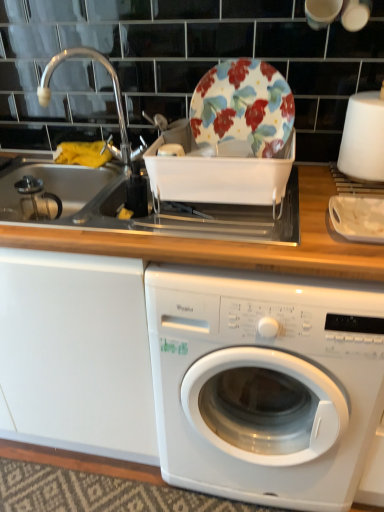
Describe the element at coordinates (265, 385) in the screenshot. This screenshot has height=512, width=384. I see `white glossy washing machine at center` at that location.

The height and width of the screenshot is (512, 384). What do you see at coordinates (358, 218) in the screenshot? I see `white plastic container at right` at bounding box center [358, 218].

This screenshot has height=512, width=384. Find the location of `floral-patterned ceramic plate at upper center`. floral-patterned ceramic plate at upper center is located at coordinates (244, 108).

From a real-world perspective, is floral-patterned ceramic plate at upper center physically above white plastic container at right?

Yes, from a real-world perspective, floral-patterned ceramic plate at upper center is on top of white plastic container at right.

Considering the relative positions of floral-patterned ceramic plate at upper center and white plastic container at right in the image provided, is floral-patterned ceramic plate at upper center to the left or to the right of white plastic container at right?

Based on their positions, floral-patterned ceramic plate at upper center is located to the left of white plastic container at right.

Identify the location of tableware located on the right of floral-patterned ceramic plate at upper center. This screenshot has height=512, width=384. (358, 218).

Based on the photo, considering the sizes of objects white glossy washing machine at center and white plastic container at right in the image provided, who is shorter, white glossy washing machine at center or white plastic container at right?

With less height is white plastic container at right.

Between white glossy washing machine at center and white plastic container at right, which one has smaller width?

With smaller width is white plastic container at right.

Is white glossy washing machine at center inside the boundaries of white plastic container at right, or outside?

white glossy washing machine at center exists outside the volume of white plastic container at right.

Is white glossy washing machine at center in contact with brushed metal sink at left?

No, white glossy washing machine at center is not beside brushed metal sink at left.

Which object is closer to the camera taking this photo, white glossy washing machine at center or brushed metal sink at left?

white glossy washing machine at center is more forward.

Which of these two, white glossy washing machine at center or brushed metal sink at left, stands shorter?

Standing shorter between the two is brushed metal sink at left.

Locate an element on the screen. This screenshot has height=512, width=384. sink behind the white glossy washing machine at center is located at coordinates (115, 100).

From the picture: Is floral-patterned ceramic plate at upper center oriented towards brushed metal sink at left?

No.

Considering the sizes of floral-patterned ceramic plate at upper center and brushed metal sink at left in the image, is floral-patterned ceramic plate at upper center taller or shorter than brushed metal sink at left?

floral-patterned ceramic plate at upper center is shorter than brushed metal sink at left.

Is floral-patterned ceramic plate at upper center wider than brushed metal sink at left?

No, floral-patterned ceramic plate at upper center is not wider than brushed metal sink at left.

Is floral-patterned ceramic plate at upper center positioned far away from brushed metal sink at left?

They are positioned close to each other.

From a real-world perspective, is white plastic container at right located higher than white glossy washing machine at center?

Correct, in the physical world, white plastic container at right is higher than white glossy washing machine at center.

Is white plastic container at right located outside white glossy washing machine at center?

Yes.

Can you confirm if white plastic container at right is smaller than white glossy washing machine at center?

Correct, white plastic container at right occupies less space than white glossy washing machine at center.

Considering the sizes of objects white plastic container at right and white glossy washing machine at center in the image provided, who is shorter, white plastic container at right or white glossy washing machine at center?

white plastic container at right.

Is white plastic container at right taller than brushed metal sink at left?

In fact, white plastic container at right may be shorter than brushed metal sink at left.

Is white plastic container at right situated inside brushed metal sink at left or outside?

white plastic container at right is not inside brushed metal sink at left, it's outside.

From a real-world perspective, which is physically above, white plastic container at right or brushed metal sink at left?

In real-world perspective, brushed metal sink at left is above.

Is white plastic container at right positioned behind brushed metal sink at left?

No, it is in front of brushed metal sink at left.

Are white plastic container at right and floral-patterned ceramic plate at upper center far apart?

No, white plastic container at right is in close proximity to floral-patterned ceramic plate at upper center.

Which object is thinner, white plastic container at right or floral-patterned ceramic plate at upper center?

Thinner between the two is floral-patterned ceramic plate at upper center.

From the image's perspective, would you say white plastic container at right is shown under floral-patterned ceramic plate at upper center?

Yes, from the image's perspective, white plastic container at right is beneath floral-patterned ceramic plate at upper center.

Where is `tableware below the floral-patterned ceramic plate at upper center (from the image's perspective)`? The image size is (384, 512). tableware below the floral-patterned ceramic plate at upper center (from the image's perspective) is located at coordinates (358, 218).

Find the location of a particular element. The width and height of the screenshot is (384, 512). tableware that is above the white glossy washing machine at center (from the image's perspective) is located at coordinates (358, 218).

From the image, which object appears to be nearer to brushed metal sink at left, white plastic container at right or floral-patterned ceramic plate at upper center?

floral-patterned ceramic plate at upper center lies closer to brushed metal sink at left than the other object.

Which object lies nearer to the anchor point white glossy washing machine at center, floral-patterned ceramic plate at upper center or white plastic container at right?

white plastic container at right is closer to white glossy washing machine at center.

Looking at the image, which one is located further to white plastic container at right, floral-patterned ceramic plate at upper center or brushed metal sink at left?

brushed metal sink at left is positioned further to the anchor white plastic container at right.

When comparing their distances from floral-patterned ceramic plate at upper center, does brushed metal sink at left or white plastic container at right seem closer?

Based on the image, white plastic container at right appears to be nearer to floral-patterned ceramic plate at upper center.

Considering their positions, is white plastic container at right positioned closer to white glossy washing machine at center than floral-patterned ceramic plate at upper center?

white plastic container at right lies closer to white glossy washing machine at center than the other object.

From the image, which object appears to be farther from white glossy washing machine at center, floral-patterned ceramic plate at upper center or brushed metal sink at left?

Based on the image, brushed metal sink at left appears to be further to white glossy washing machine at center.

When comparing their distances from floral-patterned ceramic plate at upper center, does white glossy washing machine at center or brushed metal sink at left seem closer?

brushed metal sink at left is positioned closer to the anchor floral-patterned ceramic plate at upper center.

Estimate the real-world distances between objects in this image. Which object is closer to white plastic container at right, white glossy washing machine at center or floral-patterned ceramic plate at upper center?

Based on the image, floral-patterned ceramic plate at upper center appears to be nearer to white plastic container at right.

The width and height of the screenshot is (384, 512). What are the coordinates of `tableware between floral-patterned ceramic plate at upper center and white glossy washing machine at center vertically` in the screenshot? It's located at (358, 218).

Identify the location of washing machine between brushed metal sink at left and white plastic container at right in the horizontal direction. (265, 385).

Locate an element on the screen. This screenshot has height=512, width=384. plate between brushed metal sink at left and white glossy washing machine at center in the vertical direction is located at coordinates (244, 108).

Locate an element on the screen. This screenshot has width=384, height=512. plate between brushed metal sink at left and white plastic container at right in the horizontal direction is located at coordinates (244, 108).